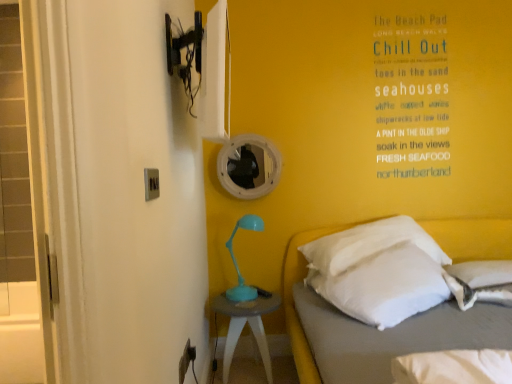
Question: From a real-world perspective, relative to matte silver switch at upper left, acting as the second electric outlet starting from the bottom, is white soft pillow at lower right, which is counted as the first pillow, starting from the right, vertically above or below?

Choices:
 (A) below
 (B) above

Answer: (A)

Question: In terms of height, does white soft pillow at lower right, which ranks as the second pillow in left-to-right order, look taller or shorter compared to matte silver switch at upper left, the 1th electric outlet viewed from the front?

Choices:
 (A) tall
 (B) short

Answer: (A)

Question: Which object is the closest to the teal plastic nightstand at lower center?

Choices:
 (A) matte gray electric outlet at lower center, positioned as the 2th electric outlet in front-to-back order
 (B) teal plastic table lamp at center
 (C) matte silver switch at upper left, the 2th electric outlet from the back
 (D) white soft pillow at right, arranged as the first pillow when viewed from the left
 (E) white soft bed at lower right

Answer: (B)

Question: Estimate the real-world distances between objects in this image. Which object is closer to the teal plastic nightstand at lower center?

Choices:
 (A) white soft pillow at right, arranged as the first pillow when viewed from the left
 (B) white soft bed at lower right
 (C) white soft pillow at lower right, which ranks as the second pillow in left-to-right order
 (D) teal plastic table lamp at center
 (E) matte gray electric outlet at lower center, the 2th electric outlet from the top

Answer: (D)